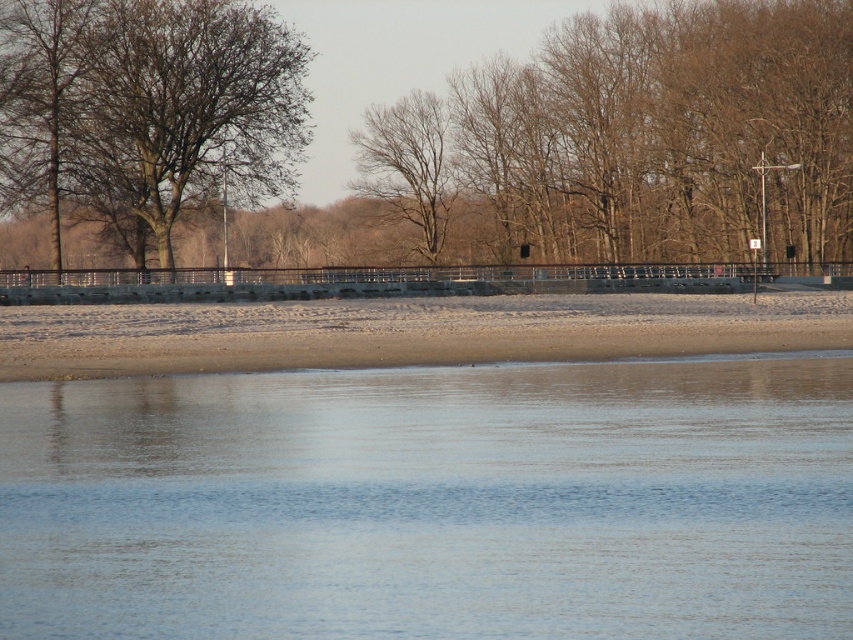
Question: Does sandy beach at lower center appear under bare wood tree at center?

Choices:
 (A) yes
 (B) no

Answer: (A)

Question: Considering the relative positions of clear water at lower center and bare wood tree at center in the image provided, where is clear water at lower center located with respect to bare wood tree at center?

Choices:
 (A) above
 (B) below

Answer: (B)

Question: Is sandy beach at lower center positioned at the back of bare wood tree at center?

Choices:
 (A) no
 (B) yes

Answer: (A)

Question: Which of the following is the farthest from the observer?

Choices:
 (A) (384, 106)
 (B) (187, 156)
 (C) (386, 602)

Answer: (A)

Question: Among these points, which one is nearest to the camera?

Choices:
 (A) (376, 106)
 (B) (444, 296)
 (C) (793, 253)
 (D) (140, 260)

Answer: (B)

Question: Estimate the real-world distances between objects in this image. Which object is closer to the bare wood tree at center?

Choices:
 (A) clear water at lower center
 (B) bare branches at left

Answer: (B)